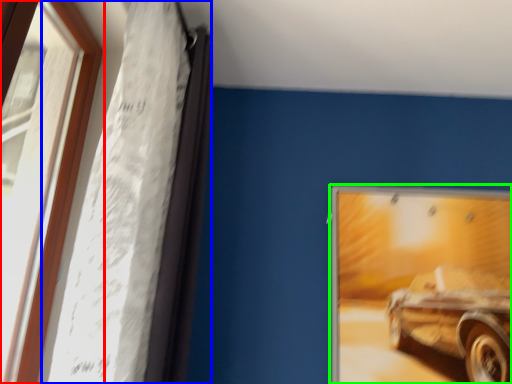
Question: Considering the real-world distances, which object is farthest from window (highlighted by a red box)? curtain (highlighted by a blue box) or picture frame (highlighted by a green box)?

Choices:
 (A) curtain
 (B) picture frame

Answer: (B)